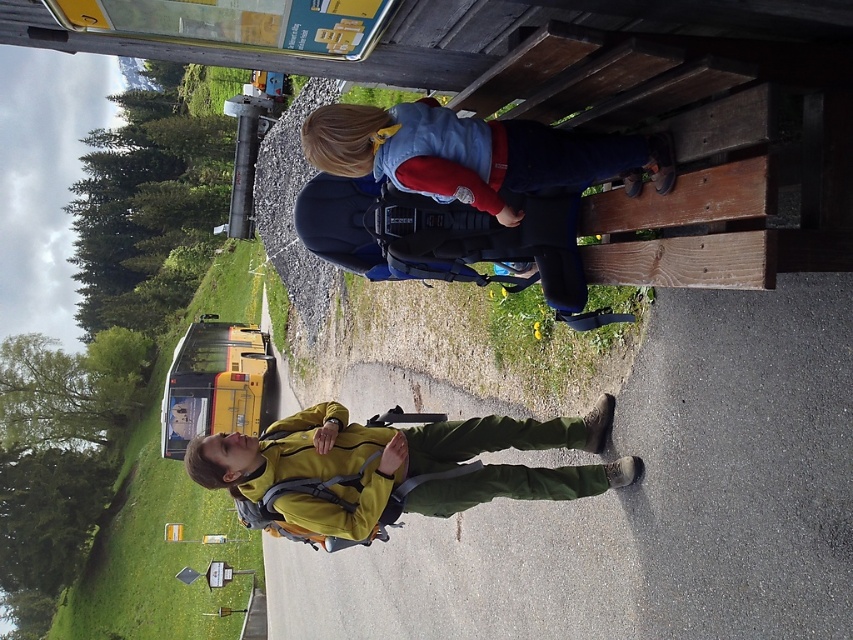
Looking at this image, you are a delivery drone trying to locate the person wearing the matte yellow jacket at lower center. According to the coordinates provided, where should you focus your search relative to the image frame?

The matte yellow jacket at lower center is located at coordinates point 0.731 on the x axis and 0.465 on the y axis, so you should focus your search at that point in the image frame.

You are a pedestrian standing on the gravel path near the bus stop. You see the matte yellow jacket at lower center and the yellow matte school bus at left. Which object is nearer to you?

The matte yellow jacket at lower center is closer to the viewer than the yellow matte school bus at left.

You are a pedestrian trying to cross the road safely. You see a denim jacket at upper center and a yellow matte school bus at left. Which object is closer to the road?

The denim jacket at upper center is positioned on the right side of the yellow matte school bus at left, meaning the school bus is closer to the road than the denim jacket.